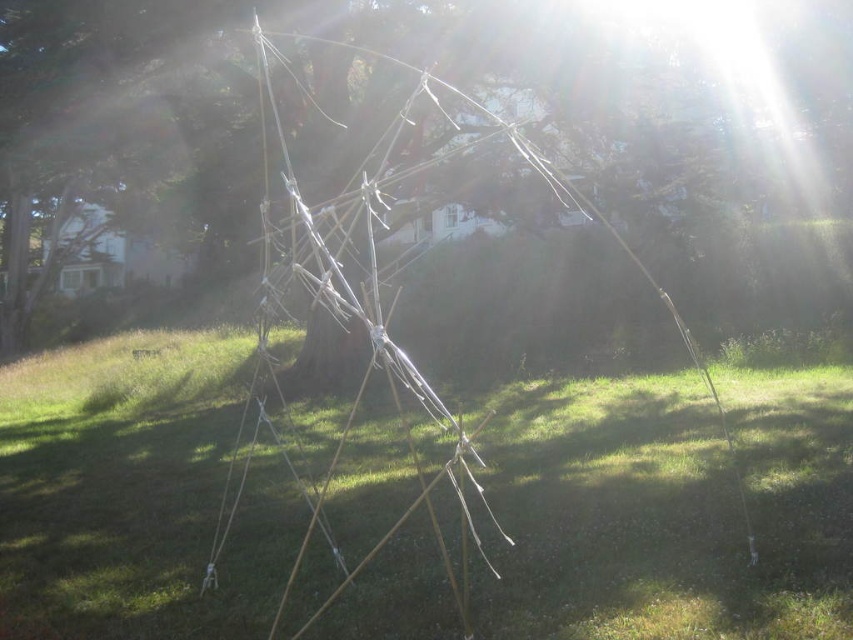
You are planning to set up a small garden in the area shown in the image. You need to know which object at the center is taller to decide where to plant your flowers. Which is taller between the green grass at center and the white stringy structure at center?

The white stringy structure at center is taller than the green grass at center, so you should consider planting flowers where the green grass at center is shorter to ensure they get enough sunlight.

You are standing at the origin point in the image, which is the bottom left corner. You want to walk to the green grass at center. Which direction should you move in terms of x and y coordinates?

To reach the green grass at center located at coordinates point (669, 508), you should move in the positive x and positive y directions from the origin point.

Based on the photo, you are standing at the edge of the grassy area and want to walk to the tree line visible in the background. The path leads directly through the green grass at center and the white stringy structure at center. Which object will you encounter first as you walk towards the tree line?

You will encounter the green grass at center first because the white stringy structure at center is behind it, meaning the grass is closer to your starting position.